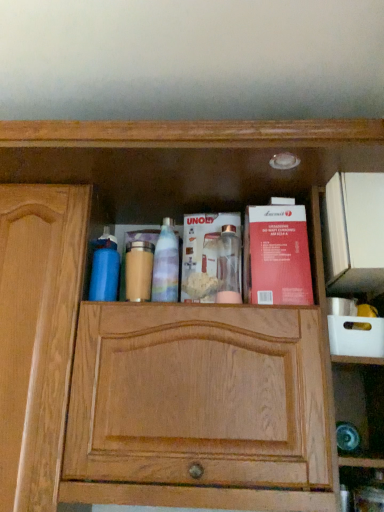
Describe the element at coordinates (207, 254) in the screenshot. I see `metallic silver blender at center, which appears as the first book when viewed from the left` at that location.

What do you see at coordinates (166, 265) in the screenshot? The height and width of the screenshot is (512, 384). I see `translucent plastic spray bottle at center, which appears as the 2th cleaning product when viewed from the left` at bounding box center [166, 265].

This screenshot has width=384, height=512. What do you see at coordinates (276, 256) in the screenshot?
I see `red matte book at center right, arranged as the second book when viewed from the left` at bounding box center [276, 256].

At what (x,y) coordinates should I click in order to perform the action: click on matte gold jar at center. Please return your answer as a coordinate pair (x, y). The width and height of the screenshot is (384, 512). Looking at the image, I should click on (138, 271).

Does translucent plastic spray bottle at center, which appears as the 2th cleaning product when viewed from the left, touch blue matte water bottle at left, arranged as the 1th cleaning product when viewed from the left?

No, translucent plastic spray bottle at center, which appears as the 2th cleaning product when viewed from the left, is not beside blue matte water bottle at left, arranged as the 1th cleaning product when viewed from the left.

Does translucent plastic spray bottle at center, which appears as the 2th cleaning product when viewed from the left, contain blue matte water bottle at left, placed as the 2th cleaning product when sorted from right to left?

No, translucent plastic spray bottle at center, which appears as the 2th cleaning product when viewed from the left, does not contain blue matte water bottle at left, placed as the 2th cleaning product when sorted from right to left.

In terms of width, does translucent plastic spray bottle at center, which appears as the 2th cleaning product when viewed from the left, look wider or thinner when compared to blue matte water bottle at left, arranged as the 1th cleaning product when viewed from the left?

In the image, translucent plastic spray bottle at center, which appears as the 2th cleaning product when viewed from the left, appears to be more narrow than blue matte water bottle at left, arranged as the 1th cleaning product when viewed from the left.

Is point (254, 234) closer to viewer compared to point (116, 239)?

That is True.

Which object is positioned more to the left, red matte book at center right, acting as the first book starting from the right, or blue matte water bottle at left, arranged as the 1th cleaning product when viewed from the left?

blue matte water bottle at left, arranged as the 1th cleaning product when viewed from the left, is more to the left.

Is red matte book at center right, acting as the first book starting from the right, looking in the opposite direction of blue matte water bottle at left, arranged as the 1th cleaning product when viewed from the left?

red matte book at center right, acting as the first book starting from the right, does not have its back to blue matte water bottle at left, arranged as the 1th cleaning product when viewed from the left.

Is red matte book at center right, acting as the first book starting from the right, beside blue matte water bottle at left, arranged as the 1th cleaning product when viewed from the left?

There is a gap between red matte book at center right, acting as the first book starting from the right, and blue matte water bottle at left, arranged as the 1th cleaning product when viewed from the left.

Is metallic silver blender at center, the 2th book from the right, shorter than blue matte water bottle at left, placed as the 2th cleaning product when sorted from right to left?

In fact, metallic silver blender at center, the 2th book from the right, may be taller than blue matte water bottle at left, placed as the 2th cleaning product when sorted from right to left.

Between metallic silver blender at center, which appears as the first book when viewed from the left, and blue matte water bottle at left, placed as the 2th cleaning product when sorted from right to left, which one has larger width?

blue matte water bottle at left, placed as the 2th cleaning product when sorted from right to left, is wider.

Consider the image. Considering the positions of objects metallic silver blender at center, the 2th book from the right, and blue matte water bottle at left, placed as the 2th cleaning product when sorted from right to left, in the image provided, who is in front, metallic silver blender at center, the 2th book from the right, or blue matte water bottle at left, placed as the 2th cleaning product when sorted from right to left,?

blue matte water bottle at left, placed as the 2th cleaning product when sorted from right to left, is more forward.

From the image's perspective, which object appears higher, metallic silver blender at center, which appears as the first book when viewed from the left, or red matte book at center right, acting as the first book starting from the right?

metallic silver blender at center, which appears as the first book when viewed from the left, appears higher in the image.

Can red matte book at center right, arranged as the second book when viewed from the left, be found inside metallic silver blender at center, which appears as the first book when viewed from the left?

Actually, red matte book at center right, arranged as the second book when viewed from the left, is outside metallic silver blender at center, which appears as the first book when viewed from the left.

Between metallic silver blender at center, the 2th book from the right, and red matte book at center right, acting as the first book starting from the right, which one has less height?

metallic silver blender at center, the 2th book from the right, is shorter.

Is metallic silver blender at center, the 2th book from the right, positioned with its back to red matte book at center right, acting as the first book starting from the right?

metallic silver blender at center, the 2th book from the right, is not turned away from red matte book at center right, acting as the first book starting from the right.

From the image's perspective, who appears lower, metallic silver blender at center, which appears as the first book when viewed from the left, or translucent plastic spray bottle at center, marked as the first cleaning product in a right-to-left arrangement?

translucent plastic spray bottle at center, marked as the first cleaning product in a right-to-left arrangement.

Between metallic silver blender at center, the 2th book from the right, and translucent plastic spray bottle at center, which appears as the 2th cleaning product when viewed from the left, which one has less height?

translucent plastic spray bottle at center, which appears as the 2th cleaning product when viewed from the left.

In the scene shown: Which of these two, metallic silver blender at center, the 2th book from the right, or translucent plastic spray bottle at center, which appears as the 2th cleaning product when viewed from the left, is smaller?

translucent plastic spray bottle at center, which appears as the 2th cleaning product when viewed from the left, is smaller.

Is metallic silver blender at center, which appears as the first book when viewed from the left, far from translucent plastic spray bottle at center, which appears as the 2th cleaning product when viewed from the left?

No, there isn't a large distance between metallic silver blender at center, which appears as the first book when viewed from the left, and translucent plastic spray bottle at center, which appears as the 2th cleaning product when viewed from the left.

Who is more distant, matte gold jar at center or metallic silver blender at center, the 2th book from the right?

metallic silver blender at center, the 2th book from the right, is further from the camera.

Are matte gold jar at center and metallic silver blender at center, the 2th book from the right, beside each other?

No, matte gold jar at center is not next to metallic silver blender at center, the 2th book from the right.

From the image's perspective, which one is positioned higher, matte gold jar at center or metallic silver blender at center, the 2th book from the right?

metallic silver blender at center, the 2th book from the right.

From a real-world perspective, which cleaning product is the 1st one above the matte gold jar at center? Please provide its 2D coordinates.

[(104, 268)]

Relative to blue matte water bottle at left, placed as the 2th cleaning product when sorted from right to left, is matte gold jar at center in front or behind?

matte gold jar at center is positioned farther from the viewer than blue matte water bottle at left, placed as the 2th cleaning product when sorted from right to left.

From the image's perspective, who appears lower, matte gold jar at center or blue matte water bottle at left, arranged as the 1th cleaning product when viewed from the left?

matte gold jar at center appears lower in the image.

How much distance is there between matte gold jar at center and blue matte water bottle at left, placed as the 2th cleaning product when sorted from right to left?

matte gold jar at center and blue matte water bottle at left, placed as the 2th cleaning product when sorted from right to left, are 2.72 inches apart.

This screenshot has width=384, height=512. What are the coordinates of `cleaning product on the right side of blue matte water bottle at left, arranged as the 1th cleaning product when viewed from the left` in the screenshot? It's located at (166, 265).

From the red matte book at center right, acting as the first book starting from the right, count 1st cleaning products backward and point to it. Please provide its 2D coordinates.

[(104, 268)]

Estimate the real-world distances between objects in this image. Which object is closer to blue matte water bottle at left, arranged as the 1th cleaning product when viewed from the left, translucent plastic spray bottle at center, which appears as the 2th cleaning product when viewed from the left, or red matte book at center right, acting as the first book starting from the right?

translucent plastic spray bottle at center, which appears as the 2th cleaning product when viewed from the left, is positioned closer to the anchor blue matte water bottle at left, arranged as the 1th cleaning product when viewed from the left.

Considering their positions, is blue matte water bottle at left, arranged as the 1th cleaning product when viewed from the left, positioned further to red matte book at center right, acting as the first book starting from the right, than matte gold jar at center?

blue matte water bottle at left, arranged as the 1th cleaning product when viewed from the left, lies further to red matte book at center right, acting as the first book starting from the right, than the other object.

Considering their positions, is red matte book at center right, arranged as the second book when viewed from the left, positioned closer to matte gold jar at center than metallic silver blender at center, the 2th book from the right?

metallic silver blender at center, the 2th book from the right, is closer to matte gold jar at center.

Estimate the real-world distances between objects in this image. Which object is further from red matte book at center right, acting as the first book starting from the right, translucent plastic spray bottle at center, which appears as the 2th cleaning product when viewed from the left, or metallic silver blender at center, the 2th book from the right?

translucent plastic spray bottle at center, which appears as the 2th cleaning product when viewed from the left.

Estimate the real-world distances between objects in this image. Which object is closer to metallic silver blender at center, which appears as the first book when viewed from the left, red matte book at center right, arranged as the second book when viewed from the left, or matte gold jar at center?

Based on the image, red matte book at center right, arranged as the second book when viewed from the left, appears to be nearer to metallic silver blender at center, which appears as the first book when viewed from the left.

In the scene shown: Based on their spatial positions, is blue matte water bottle at left, placed as the 2th cleaning product when sorted from right to left, or metallic silver blender at center, the 2th book from the right, further from matte gold jar at center?

The object further to matte gold jar at center is metallic silver blender at center, the 2th book from the right.

Based on their spatial positions, is matte gold jar at center or blue matte water bottle at left, placed as the 2th cleaning product when sorted from right to left, closer to translucent plastic spray bottle at center, which appears as the 2th cleaning product when viewed from the left?

The object closer to translucent plastic spray bottle at center, which appears as the 2th cleaning product when viewed from the left, is matte gold jar at center.

When comparing their distances from metallic silver blender at center, which appears as the first book when viewed from the left, does blue matte water bottle at left, placed as the 2th cleaning product when sorted from right to left, or red matte book at center right, acting as the first book starting from the right, seem closer?

The object closer to metallic silver blender at center, which appears as the first book when viewed from the left, is red matte book at center right, acting as the first book starting from the right.

The height and width of the screenshot is (512, 384). What are the coordinates of `toiletry between blue matte water bottle at left, placed as the 2th cleaning product when sorted from right to left, and translucent plastic spray bottle at center, marked as the first cleaning product in a right-to-left arrangement` in the screenshot? It's located at point(138,271).

Image resolution: width=384 pixels, height=512 pixels. I want to click on book situated between matte gold jar at center and red matte book at center right, arranged as the second book when viewed from the left, from left to right, so click(207, 254).

Identify the location of toiletry located between blue matte water bottle at left, arranged as the 1th cleaning product when viewed from the left, and red matte book at center right, arranged as the second book when viewed from the left, in the left-right direction. The height and width of the screenshot is (512, 384). (138, 271).

This screenshot has height=512, width=384. In order to click on cleaning product between matte gold jar at center and metallic silver blender at center, which appears as the first book when viewed from the left, in the horizontal direction in this screenshot , I will do `click(166, 265)`.